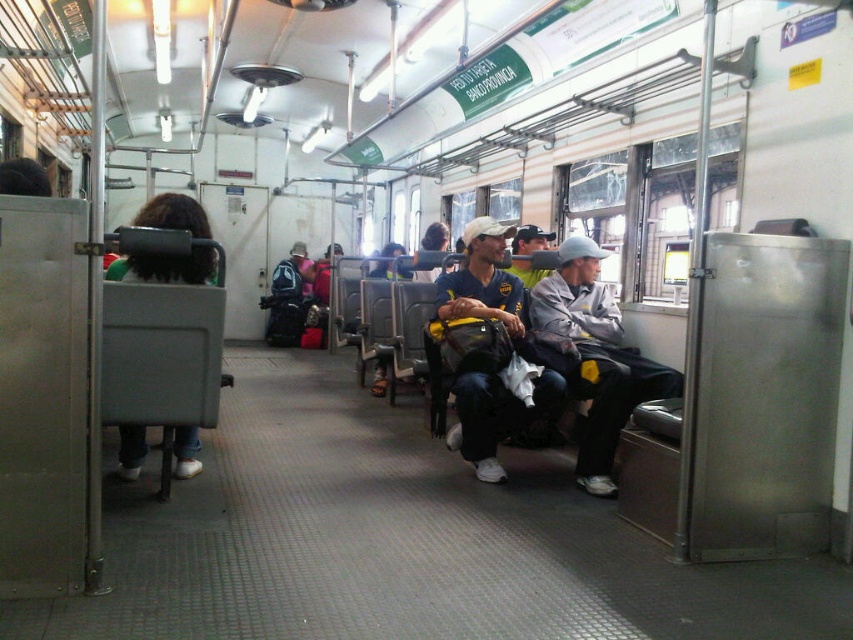
You are a passenger on the train and you want to place a 12 inch wide backpack between the matte blue shirt at center and the matte blue cap at center. Can you fit it there?

The distance between the matte blue shirt at center and the matte blue cap at center is 29.14 inches. Since the backpack is 12 inches wide, there is enough space to fit it between them.

You are a passenger on the train and want to sit down. You see a gray fabric jacket at center and a matte blue shirt at center. Which seat is more spacious to sit next to?

The gray fabric jacket at center is wider than the matte blue shirt at center, so the seat next to the gray fabric jacket at center is more spacious.